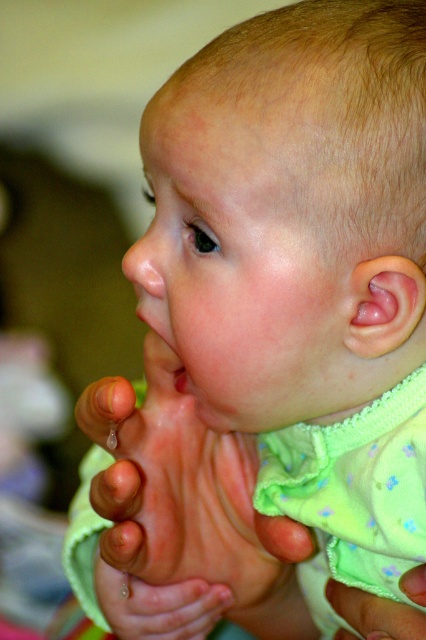
In the scene shown: Based on the scene description, can you determine the position of the pink smooth foot at center relative to the green fabric hand at lower center?

The pink smooth foot at center is located above the green fabric hand at lower center.

Based on the scene description, can you determine if the pink smooth foot at center is wider than the green fabric hand at lower center?

The pink smooth foot at center is wider than green fabric hand at lower center according to the description.

The baby is holding both feet with their hands. Which object is taller when comparing the pink smooth foot at center and the green fabric hand at lower center?

The pink smooth foot at center is taller than the green fabric hand at lower center.